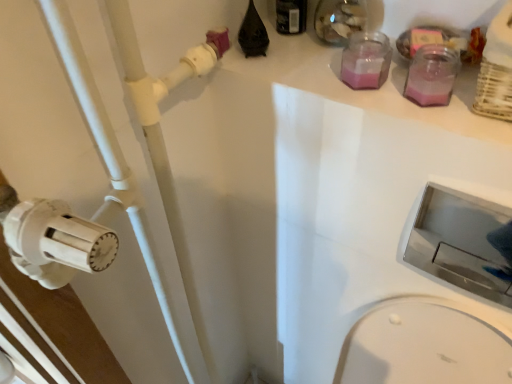
What do you see at coordinates (111, 160) in the screenshot? I see `white plastic pipe at left` at bounding box center [111, 160].

Describe the element at coordinates (291, 16) in the screenshot. I see `black plastic bottle at upper center, which is the first bottle in top-to-bottom order` at that location.

This screenshot has width=512, height=384. Find the location of `pink glass jar at upper right, which ranks as the 1th bottle in right-to-left order`. pink glass jar at upper right, which ranks as the 1th bottle in right-to-left order is located at coordinates (432, 75).

At what (x,y) coordinates should I click in order to perform the action: click on metallic silver sink at lower right. Please return your answer as a coordinate pair (x, y). Looking at the image, I should click on (459, 241).

Who is shorter, white plastic pipe at left or metallic silver sink at lower right?

Standing shorter between the two is metallic silver sink at lower right.

Identify the location of sink lying on the right of white plastic pipe at left. The width and height of the screenshot is (512, 384). pyautogui.click(x=459, y=241).

Are white plastic pipe at left and metallic silver sink at lower right beside each other?

No.

From a real-world perspective, is black plastic bottle at upper center, which is the first bottle in top-to-bottom order, positioned over metallic silver sink at lower right based on gravity?

Yes, from a real-world perspective, black plastic bottle at upper center, which is the first bottle in top-to-bottom order, is on top of metallic silver sink at lower right.

How different are the orientations of black plastic bottle at upper center, which is the first bottle in top-to-bottom order, and metallic silver sink at lower right in degrees?

1.41 degrees separate the facing orientations of black plastic bottle at upper center, which is the first bottle in top-to-bottom order, and metallic silver sink at lower right.

Does black plastic bottle at upper center, the first bottle in the left-to-right sequence, have a lesser width compared to metallic silver sink at lower right?

In fact, black plastic bottle at upper center, the first bottle in the left-to-right sequence, might be wider than metallic silver sink at lower right.

From the image's perspective, which is above, black plastic bottle at upper center, which is the first bottle in top-to-bottom order, or metallic silver sink at lower right?

From the image's view, black plastic bottle at upper center, which is the first bottle in top-to-bottom order, is above.

Based on the photo, is metallic silver sink at lower right taller than white plastic pipe at left?

No, metallic silver sink at lower right is not taller than white plastic pipe at left.

Relative to white plastic pipe at left, is metallic silver sink at lower right in front or behind?

metallic silver sink at lower right is behind white plastic pipe at left.

Is white plastic pipe at left at the back of metallic silver sink at lower right?

That's not correct — metallic silver sink at lower right is not looking away from white plastic pipe at left.

Which object is wider, white plastic pipe at left or pink glass jar at upper right, acting as the 1th bottle starting from the bottom?

Wider between the two is white plastic pipe at left.

Does white plastic pipe at left touch pink glass jar at upper right, acting as the 1th bottle starting from the bottom?

No, white plastic pipe at left is not touching pink glass jar at upper right, acting as the 1th bottle starting from the bottom.

From a real-world perspective, is white plastic pipe at left positioned over pink glass jar at upper right, the second bottle in the top-to-bottom sequence, based on gravity?

No, from a real-world perspective, white plastic pipe at left is not over pink glass jar at upper right, the second bottle in the top-to-bottom sequence

I want to click on pipe below the pink glass jar at upper right, which is the second bottle from left to right (from the image's perspective), so click(x=111, y=160).

Looking at their sizes, would you say white plastic pipe at left is wider or thinner than black plastic bottle at upper center, which is the 2th bottle in right-to-left order?

In the image, white plastic pipe at left appears to be wider than black plastic bottle at upper center, which is the 2th bottle in right-to-left order.

From the image's perspective, which bottle is the 2nd one above the white plastic pipe at left? Please provide its 2D coordinates.

[(291, 16)]

From the image's perspective, is white plastic pipe at left located beneath black plastic bottle at upper center, which is the 2th bottle in right-to-left order?

Yes.

Considering the relative sizes of pink glass jar at upper right, which ranks as the 1th bottle in right-to-left order, and metallic silver sink at lower right in the image provided, is pink glass jar at upper right, which ranks as the 1th bottle in right-to-left order, taller than metallic silver sink at lower right?

Incorrect, the height of pink glass jar at upper right, which ranks as the 1th bottle in right-to-left order, is not larger of that of metallic silver sink at lower right.

Is pink glass jar at upper right, which ranks as the 1th bottle in right-to-left order, facing towards metallic silver sink at lower right?

No, pink glass jar at upper right, which ranks as the 1th bottle in right-to-left order, is not turned towards metallic silver sink at lower right.

How much distance is there between pink glass jar at upper right, which ranks as the 1th bottle in right-to-left order, and metallic silver sink at lower right?

pink glass jar at upper right, which ranks as the 1th bottle in right-to-left order, is 78.16 centimeters away from metallic silver sink at lower right.

Is pink glass jar at upper right, acting as the 1th bottle starting from the bottom, far from metallic silver sink at lower right?

pink glass jar at upper right, acting as the 1th bottle starting from the bottom, is actually quite close to metallic silver sink at lower right.

Does metallic silver sink at lower right turn towards pink glass jar at upper right, acting as the 1th bottle starting from the bottom?

No, metallic silver sink at lower right does not turn towards pink glass jar at upper right, acting as the 1th bottle starting from the bottom.

Choose the correct answer: Is metallic silver sink at lower right inside pink glass jar at upper right, acting as the 1th bottle starting from the bottom, or outside it?

metallic silver sink at lower right is outside pink glass jar at upper right, acting as the 1th bottle starting from the bottom.

From the image's perspective, which one is positioned higher, metallic silver sink at lower right or pink glass jar at upper right, the second bottle in the top-to-bottom sequence?

pink glass jar at upper right, the second bottle in the top-to-bottom sequence, appears higher in the image.

Considering the relative sizes of metallic silver sink at lower right and pink glass jar at upper right, which is the second bottle from left to right, in the image provided, is metallic silver sink at lower right thinner than pink glass jar at upper right, which is the second bottle from left to right,?

Yes, metallic silver sink at lower right is thinner than pink glass jar at upper right, which is the second bottle from left to right.

Find the location of `sink above the white plastic pipe at left (from a real-world perspective)`. sink above the white plastic pipe at left (from a real-world perspective) is located at coordinates (459, 241).

This screenshot has height=384, width=512. Find the location of `sink below the black plastic bottle at upper center, which is counted as the second bottle, starting from the bottom (from a real-world perspective)`. sink below the black plastic bottle at upper center, which is counted as the second bottle, starting from the bottom (from a real-world perspective) is located at coordinates (459, 241).

Looking at the image, which one is located closer to pink glass jar at upper right, which is the second bottle from left to right, metallic silver sink at lower right or black plastic bottle at upper center, which is the 2th bottle in right-to-left order?

black plastic bottle at upper center, which is the 2th bottle in right-to-left order, is positioned closer to the anchor pink glass jar at upper right, which is the second bottle from left to right.

Which object lies nearer to the anchor point pink glass jar at upper right, which ranks as the 1th bottle in right-to-left order, black plastic bottle at upper center, the first bottle in the left-to-right sequence, or white plastic pipe at left?

Based on the image, black plastic bottle at upper center, the first bottle in the left-to-right sequence, appears to be nearer to pink glass jar at upper right, which ranks as the 1th bottle in right-to-left order.

Looking at the image, which one is located further to metallic silver sink at lower right, pink glass jar at upper right, which is the second bottle from left to right, or black plastic bottle at upper center, which is the first bottle in top-to-bottom order?

The object further to metallic silver sink at lower right is black plastic bottle at upper center, which is the first bottle in top-to-bottom order.

Based on their spatial positions, is white plastic pipe at left or black plastic bottle at upper center, the first bottle in the left-to-right sequence, closer to metallic silver sink at lower right?

white plastic pipe at left.

When comparing their distances from metallic silver sink at lower right, does pink glass jar at upper right, which ranks as the 1th bottle in right-to-left order, or white plastic pipe at left seem closer?

white plastic pipe at left is positioned closer to the anchor metallic silver sink at lower right.

From the image, which object appears to be farther from white plastic pipe at left, black plastic bottle at upper center, which is the first bottle in top-to-bottom order, or metallic silver sink at lower right?

Among the two, metallic silver sink at lower right is located further to white plastic pipe at left.

Looking at the image, which one is located further to pink glass jar at upper right, which is the second bottle from left to right, black plastic bottle at upper center, which is the 2th bottle in right-to-left order, or metallic silver sink at lower right?

metallic silver sink at lower right is positioned further to the anchor pink glass jar at upper right, which is the second bottle from left to right.

Estimate the real-world distances between objects in this image. Which object is closer to white plastic pipe at left, metallic silver sink at lower right or pink glass jar at upper right, acting as the 1th bottle starting from the bottom?

pink glass jar at upper right, acting as the 1th bottle starting from the bottom, is positioned closer to the anchor white plastic pipe at left.

You are a GUI agent. You are given a task and a screenshot of the screen. Output one action in this format:
    pyautogui.click(x=<x>, y=<y>)
    Task: Click on the sink that lies between black plastic bottle at upper center, which is the first bottle in top-to-bottom order, and white plastic pipe at left from top to bottom
    Image resolution: width=512 pixels, height=384 pixels.
    Given the screenshot: What is the action you would take?
    pyautogui.click(x=459, y=241)

Locate an element on the screen. bottle between black plastic bottle at upper center, the first bottle in the left-to-right sequence, and metallic silver sink at lower right, in the vertical direction is located at coordinates (432, 75).

Find the location of a particular element. This screenshot has width=512, height=384. bottle between black plastic bottle at upper center, the first bottle in the left-to-right sequence, and white plastic pipe at left in the up-down direction is located at coordinates (432, 75).